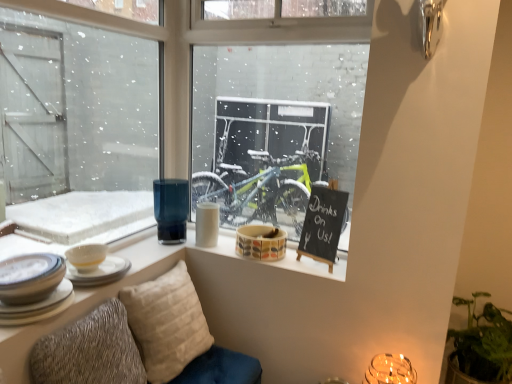
Question: Is black chalkboard at upper right completely or partially outside of white ceramic plates at lower left, placed as the 6th tableware when sorted from right to left?

Choices:
 (A) yes
 (B) no

Answer: (A)

Question: Could you tell me if black chalkboard at upper right is turned towards white ceramic plates at lower left, placed as the 6th tableware when sorted from right to left?

Choices:
 (A) no
 (B) yes

Answer: (B)

Question: Is white ceramic plates at lower left, the 2th tableware from the left, at the back of black chalkboard at upper right?

Choices:
 (A) yes
 (B) no

Answer: (B)

Question: Considering the relative positions of black chalkboard at upper right and white ceramic plates at lower left, placed as the 6th tableware when sorted from right to left, in the image provided, is black chalkboard at upper right in front of white ceramic plates at lower left, placed as the 6th tableware when sorted from right to left,?

Choices:
 (A) no
 (B) yes

Answer: (A)

Question: Considering the relative sizes of black chalkboard at upper right and white ceramic plates at lower left, the 2th tableware from the left, in the image provided, is black chalkboard at upper right wider than white ceramic plates at lower left, the 2th tableware from the left,?

Choices:
 (A) no
 (B) yes

Answer: (A)

Question: From a real-world perspective, relative to translucent glass candle holder at lower right, is white ceramic plates at lower left, which is the fourth tableware in right-to-left order, vertically above or below?

Choices:
 (A) below
 (B) above

Answer: (B)

Question: Based on their sizes in the image, would you say white ceramic plates at lower left, which is the fourth tableware in right-to-left order, is bigger or smaller than translucent glass candle holder at lower right?

Choices:
 (A) big
 (B) small

Answer: (B)

Question: Would you say white ceramic plates at lower left, which is the fourth tableware in right-to-left order, is inside or outside translucent glass candle holder at lower right?

Choices:
 (A) outside
 (B) inside

Answer: (A)

Question: In the image, is white ceramic plates at lower left, which is the fourth tableware in right-to-left order, on the left side or the right side of translucent glass candle holder at lower right?

Choices:
 (A) right
 (B) left

Answer: (B)

Question: From a real-world perspective, relative to white ceramic bowl at left, acting as the third tableware starting from the left, is green leafy plant at lower right vertically above or below?

Choices:
 (A) below
 (B) above

Answer: (A)

Question: Choose the correct answer: Is green leafy plant at lower right inside white ceramic bowl at left, the fifth tableware viewed from the right, or outside it?

Choices:
 (A) outside
 (B) inside

Answer: (A)

Question: Looking at the image, does green leafy plant at lower right seem bigger or smaller compared to white ceramic bowl at left, acting as the third tableware starting from the left?

Choices:
 (A) small
 (B) big

Answer: (B)

Question: Is green leafy plant at lower right in front of or behind white ceramic bowl at left, acting as the third tableware starting from the left, in the image?

Choices:
 (A) behind
 (B) front

Answer: (B)

Question: In the image, is textured beige pillow at lower left, the 2th pillow positioned from the back, on the left side or the right side of multicolored ceramic mug at center, the 7th tableware in the left-to-right sequence?

Choices:
 (A) left
 (B) right

Answer: (A)

Question: Is textured beige pillow at lower left, the 2th pillow positioned from the back, spatially inside multicolored ceramic mug at center, the 1th tableware from the right, or outside of it?

Choices:
 (A) inside
 (B) outside

Answer: (B)